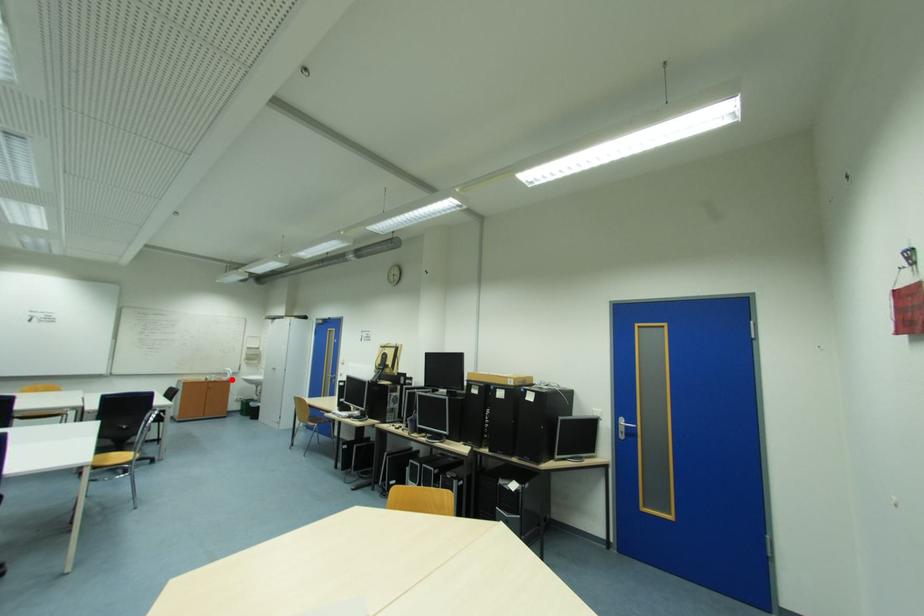
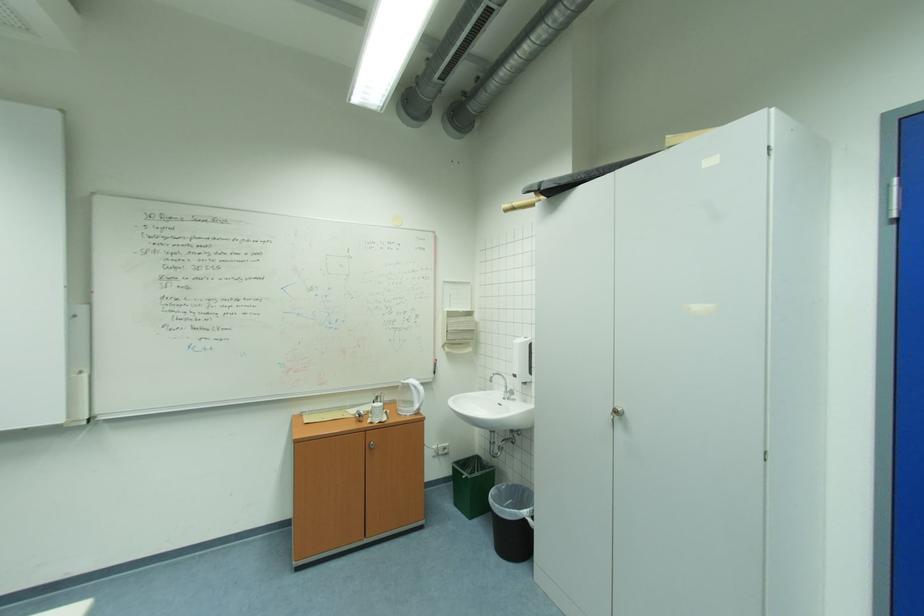
Question: I am providing you with two images of the same scene from different viewpoints. A red point is marked on the first image. Can you still see the location of the red point in image 2?

Choices:
 (A) Yes
 (B) No

Answer: (A)